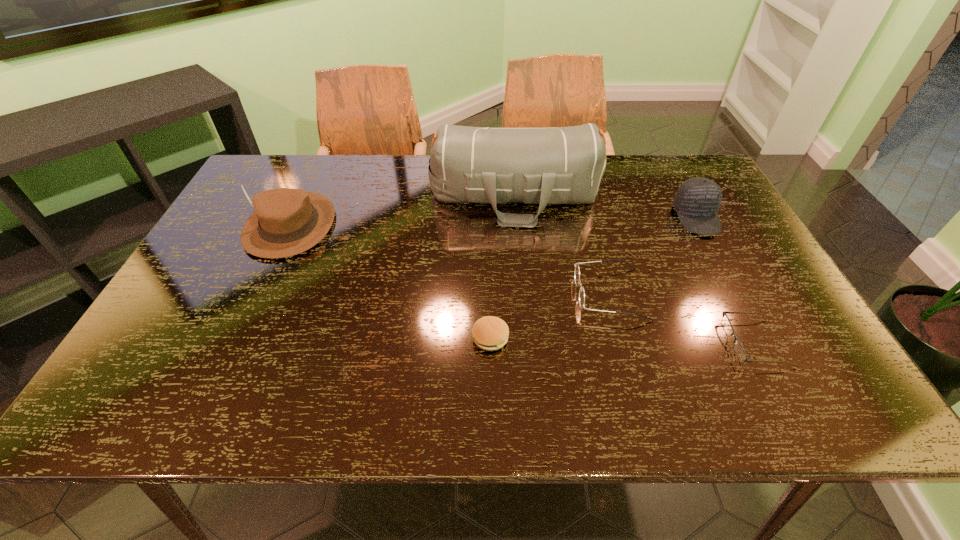
Locate an element on the screen. blank area located 0.290m on the feather side of the fedora is located at coordinates (229, 355).

Identify the location of free space located at the front of the baseball cap where the brim is located. (737, 292).

Locate an element on the screen. This screenshot has width=960, height=540. free space located 0.200m through the lenses of the taller spectacles is located at coordinates (493, 294).

Identify the location of vacant space located 0.280m through the lenses of the taller spectacles. This screenshot has height=540, width=960. (460, 294).

Locate an element on the screen. vacant region located through the lenses of the taller spectacles is located at coordinates (547, 294).

Identify the location of vacant area located 0.070m on the front of the patty. coord(492,382).

Find the location of a particular element. vacant region located on the front-facing side of the shortest object is located at coordinates click(551, 342).

The width and height of the screenshot is (960, 540). I want to click on blank space located 0.060m on the front-facing side of the shortest object, so click(702, 342).

Identify the location of free spot located on the front-facing side of the shortest object. The height and width of the screenshot is (540, 960). (547, 342).

The width and height of the screenshot is (960, 540). I want to click on duffel bag present at the far edge, so click(x=552, y=165).